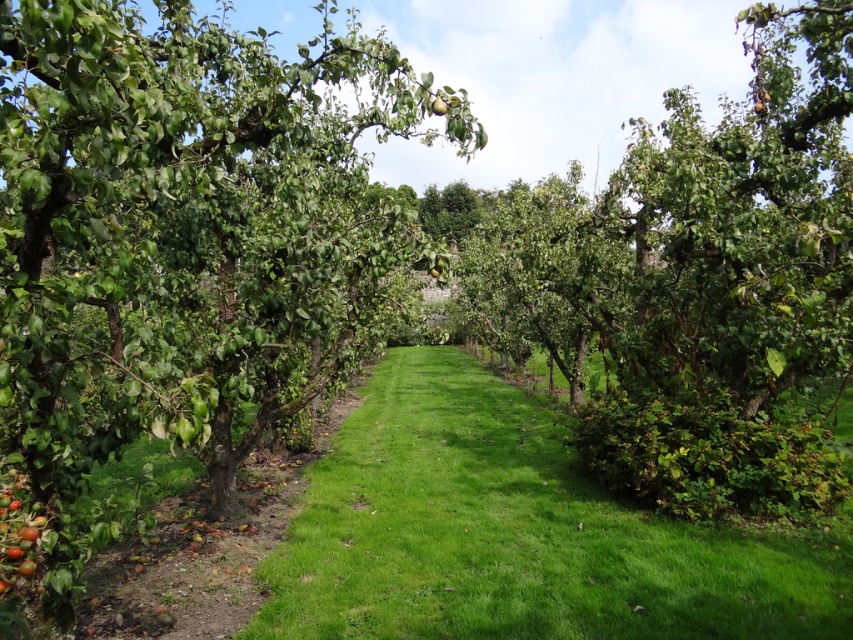
Consider the image. Does green grass at center appear under green matte apple at center?

Yes, green grass at center is below green matte apple at center.

Locate an element on the screen. This screenshot has width=853, height=640. green grass at center is located at coordinates (518, 532).

Is point (422, 346) farther from camera compared to point (430, 272)?

Yes, it is behind point (430, 272).

Find the location of a particular element. The height and width of the screenshot is (640, 853). green grass at center is located at coordinates (518, 532).

Is the position of green leafy tree at center more distant than that of green matte apple at center?

No, green leafy tree at center is closer to the viewer.

Between green leafy tree at center and green matte apple at center, which one has more height?

Standing taller between the two is green leafy tree at center.

Describe the element at coordinates (184, 241) in the screenshot. The height and width of the screenshot is (640, 853). I see `green leafy tree at center` at that location.

You are a GUI agent. You are given a task and a screenshot of the screen. Output one action in this format:
    pyautogui.click(x=<x>, y=<y>)
    Task: Click on the green leafy tree at center
    The height and width of the screenshot is (640, 853).
    Given the screenshot: What is the action you would take?
    pyautogui.click(x=184, y=241)

Can you confirm if green leafy tree at center is positioned above green grass at center?

Yes.

Based on the photo, is green leafy tree at center bigger than green grass at center?

No, green leafy tree at center is not bigger than green grass at center.

Does point (132, 324) come farther from viewer compared to point (460, 513)?

Yes.

What are the coordinates of `green leafy tree at center` in the screenshot? It's located at (184, 241).